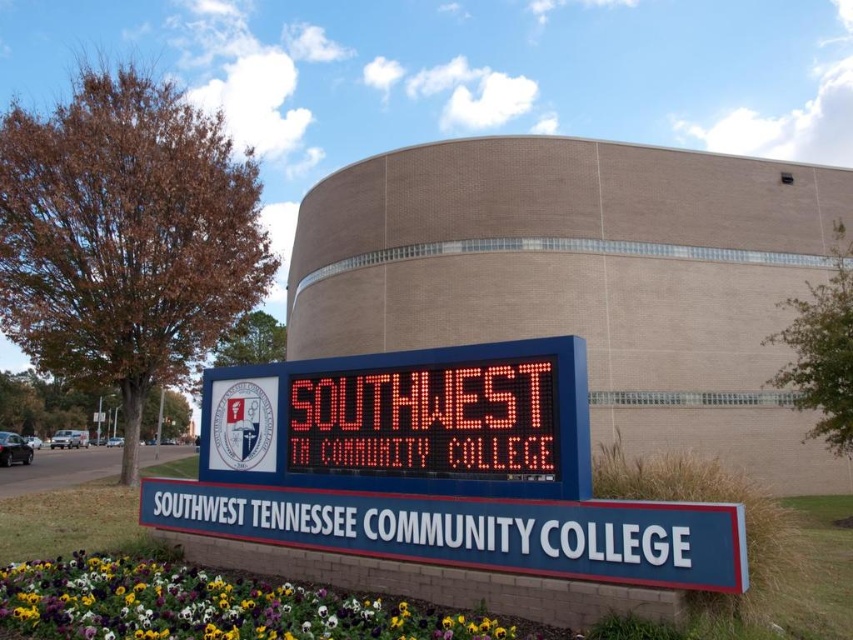
From the picture: You are standing at the entrance of Southwest Tennessee Community College and notice two points on the digital display board. The first point is at coordinates point (57, 618) and the second is at point (352, 456). Which of these two points is closer to you?

Point (57, 618) is closer to the viewer than point (352, 456).

You are a student trying to take a photo of the entrance signage for Southwest Tennessee Community College. You want to include both the multicolored petals at lower center and the led display at center in your photo. Which object should you focus on first to ensure both are in frame?

You should focus on the multicolored petals at lower center first because they are larger in size compared to the led display at center, ensuring they fit properly in the frame.